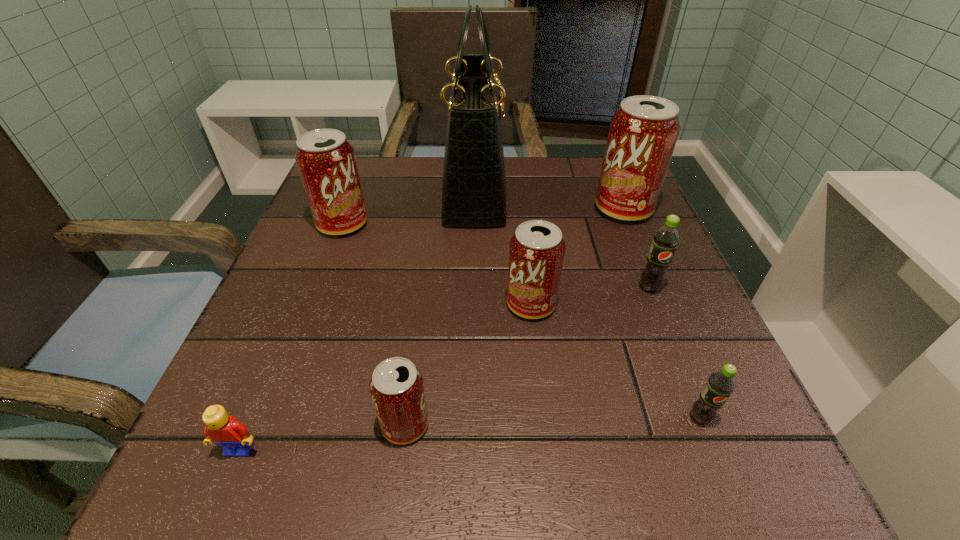
Where is `the smaller green soda`? the smaller green soda is located at coordinates (720, 384).

This screenshot has width=960, height=540. I want to click on Lego, so click(225, 431).

Identify the location of yellow Lego. [x=225, y=431].

The image size is (960, 540). In order to click on vacant space located 0.220m at the front of the tallest object with visible charms in this screenshot , I will do `click(598, 192)`.

Find the location of a particular element. Image resolution: width=960 pixels, height=540 pixels. free region located 0.380m on the front of the second tallest object is located at coordinates (694, 377).

This screenshot has height=540, width=960. In order to click on vacant space located on the front of the sixth shortest object in this screenshot , I will do `click(276, 399)`.

Locate an element on the screen. free space located 0.330m on the back of the third farthest red soda can is located at coordinates (517, 190).

You are a GUI agent. You are given a task and a screenshot of the screen. Output one action in this format:
    pyautogui.click(x=<x>, y=<y>)
    Task: Click on the vacant space situated 0.120m on the front label of the farther green soda
    Image resolution: width=960 pixels, height=540 pixels.
    Given the screenshot: What is the action you would take?
    pyautogui.click(x=674, y=349)

Locate an element on the screen. vacant area situated 0.110m on the left of the smallest red soda can is located at coordinates (301, 424).

At what (x,y) coordinates should I click in order to perform the action: click on vacant space located on the front label of the nearer green soda. Please return your answer as a coordinate pair (x, y). Looking at the image, I should click on (722, 472).